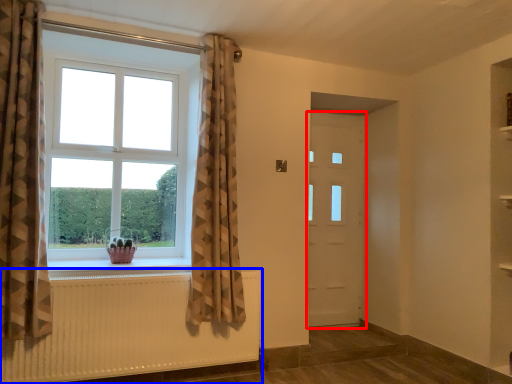
Question: Among these objects, which one is nearest to the camera, door (highlighted by a red box) or radiator (highlighted by a blue box)?

Choices:
 (A) door
 (B) radiator

Answer: (B)